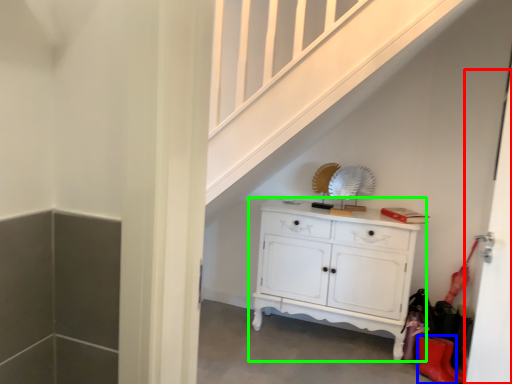
Question: Which object is positioned farthest from door (highlighted by a red box)? Select from shoe (highlighted by a blue box) and chest of drawers (highlighted by a green box).

Choices:
 (A) shoe
 (B) chest of drawers

Answer: (A)